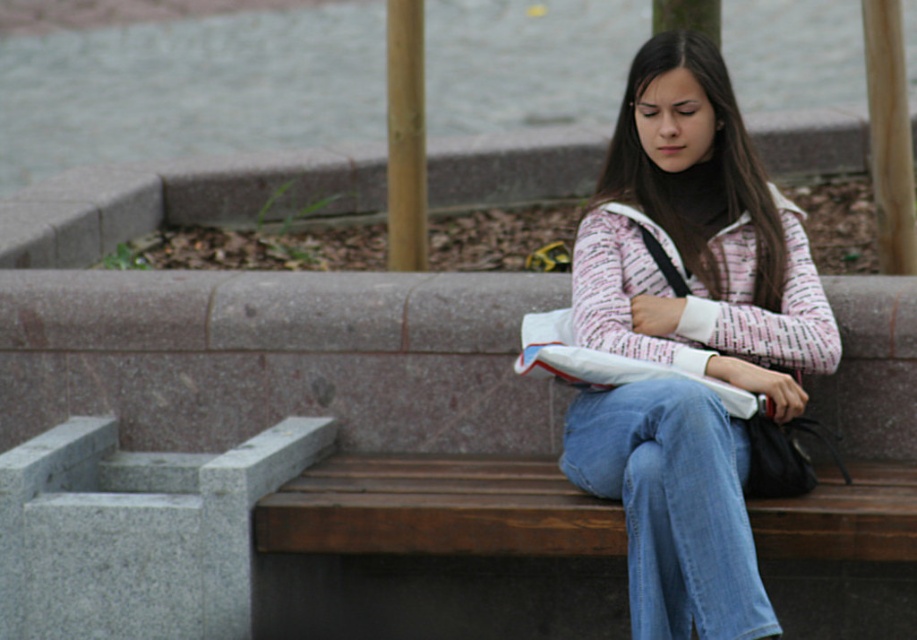
In the scene shown: Where is the wooden bench at center located in the image?

The wooden bench at center is located at point (268, 451) in the image.

You are standing in the urban park and want to sit next to the person on the wooden bench at center. Where should you sit relative to the denim at right?

You should sit to the left of the denim at right because the wooden bench at center is located to the left of the denim at right, so sitting there would place you next to the person on the wooden bench at center.